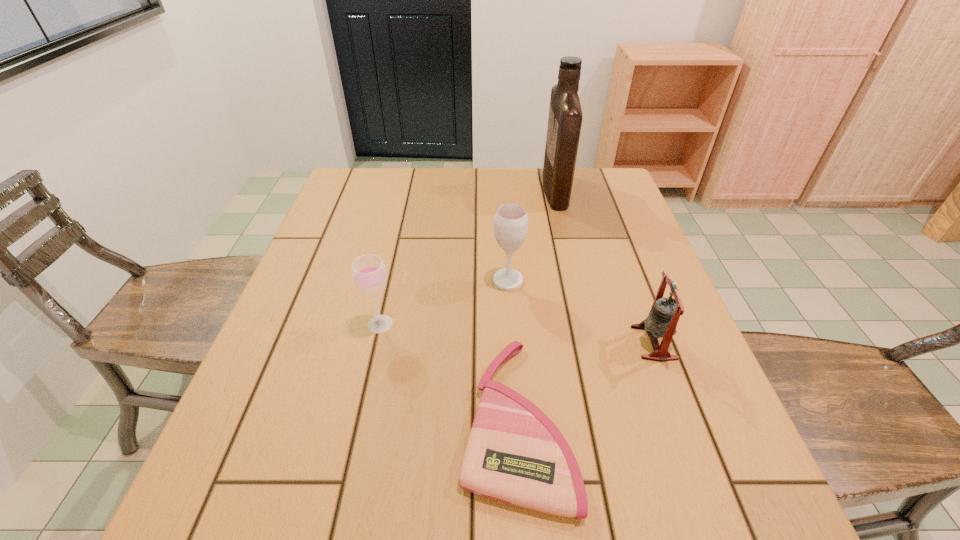
What are the coordinates of `blank space located 0.370m on the label side of the liquor` in the screenshot? It's located at (424, 190).

You are a GUI agent. You are given a task and a screenshot of the screen. Output one action in this format:
    pyautogui.click(x=<x>, y=<y>)
    Task: Click on the vacant area situated on the back of the farther wineglass
    
    Given the screenshot: What is the action you would take?
    pyautogui.click(x=503, y=214)

You are a GUI agent. You are given a task and a screenshot of the screen. Output one action in this format:
    pyautogui.click(x=<x>, y=<y>)
    Task: Click on the free space located 0.390m on the back of the shorter wineglass
    
    Given the screenshot: What is the action you would take?
    pyautogui.click(x=405, y=214)

Where is `free region located 0.220m on the back of the bell`? The height and width of the screenshot is (540, 960). free region located 0.220m on the back of the bell is located at coordinates (622, 259).

At what (x,y) coordinates should I click in order to perform the action: click on vacant area situated on the back of the wristlet. Please return your answer as a coordinate pair (x, y). Looking at the image, I should click on (504, 241).

This screenshot has width=960, height=540. Find the location of `object that is at the far edge`. object that is at the far edge is located at coordinates (565, 117).

The width and height of the screenshot is (960, 540). Find the location of `object positioned at the near edge`. object positioned at the near edge is located at coordinates (515, 454).

Locate an element on the screen. This screenshot has height=540, width=960. object positioned at the right edge is located at coordinates (664, 315).

Identify the location of free space at the far edge. (572, 207).

Where is `vacant space at the near edge of the desktop`? vacant space at the near edge of the desktop is located at coordinates (510, 514).